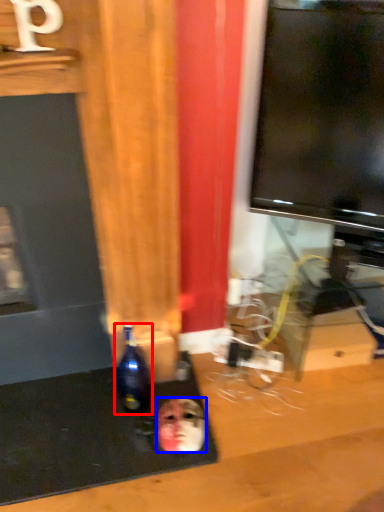
Question: Which object appears closest to the camera in this image, bottle (highlighted by a red box) or human face (highlighted by a blue box)?

Choices:
 (A) bottle
 (B) human face

Answer: (A)